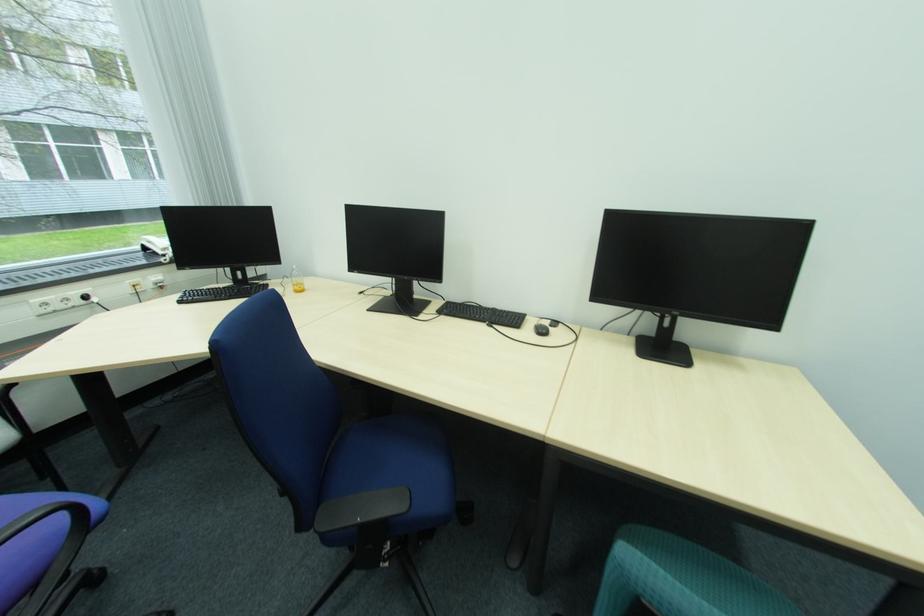
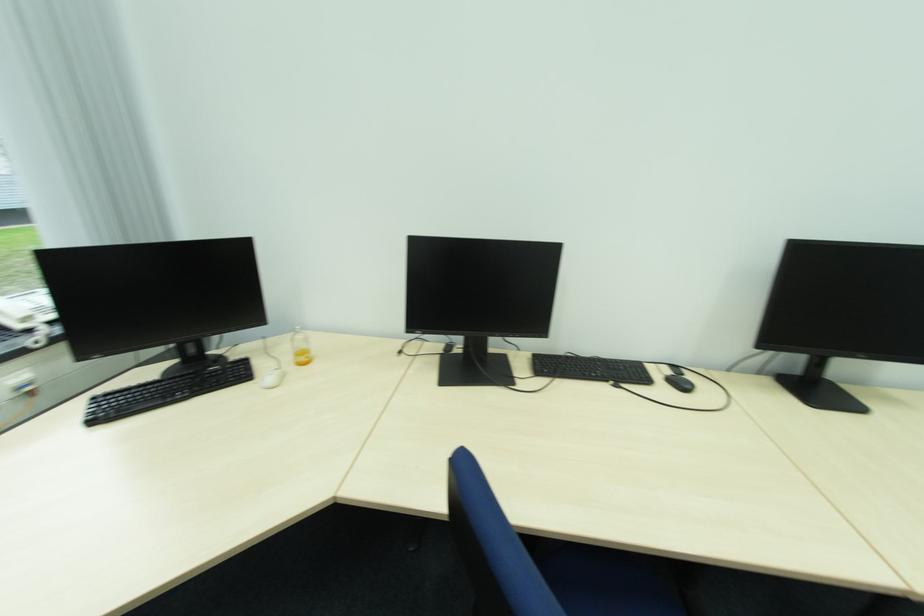
In the second image, find the point that corresponds to [172,249] in the first image.

(31, 320)